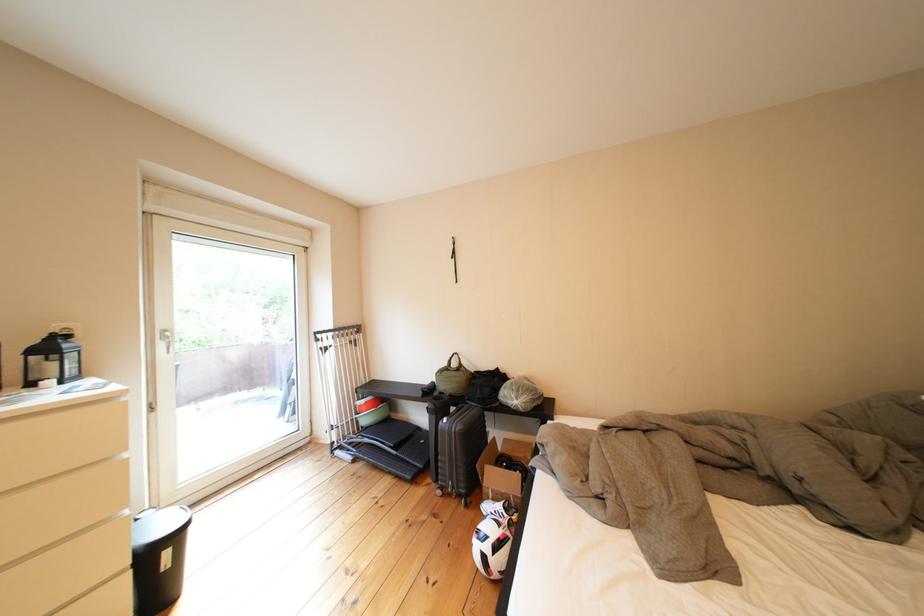
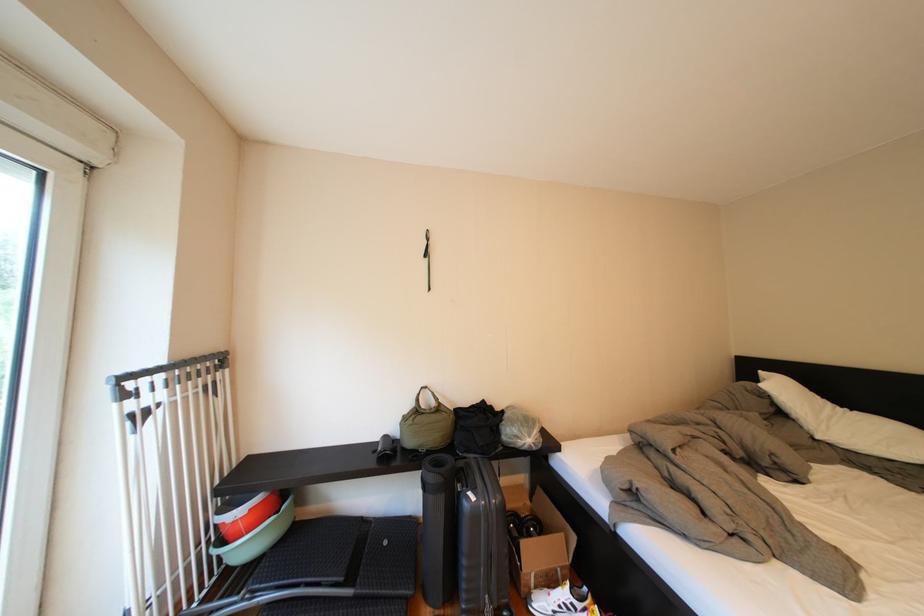
The point at (380, 424) is marked in the first image. Where is the corresponding point in the second image?

(261, 551)